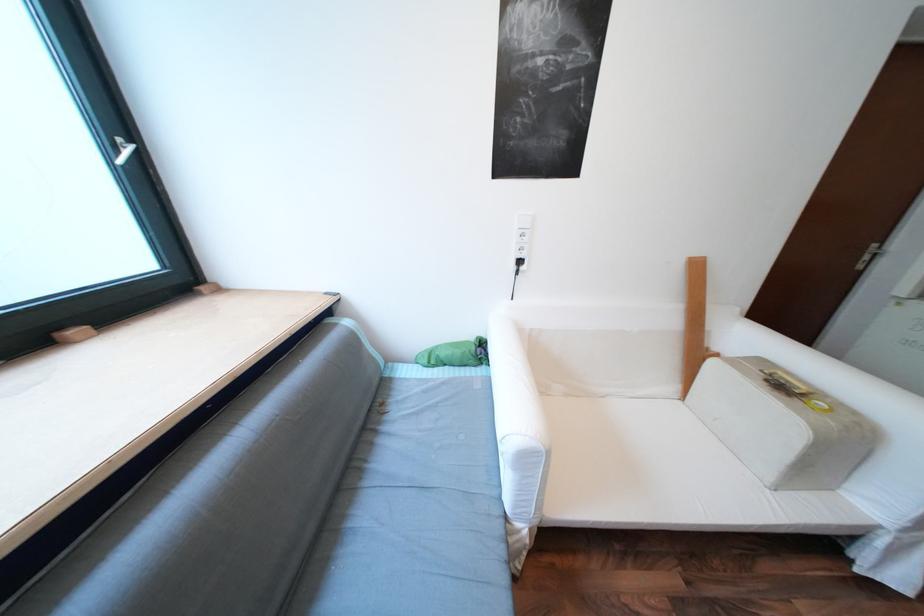
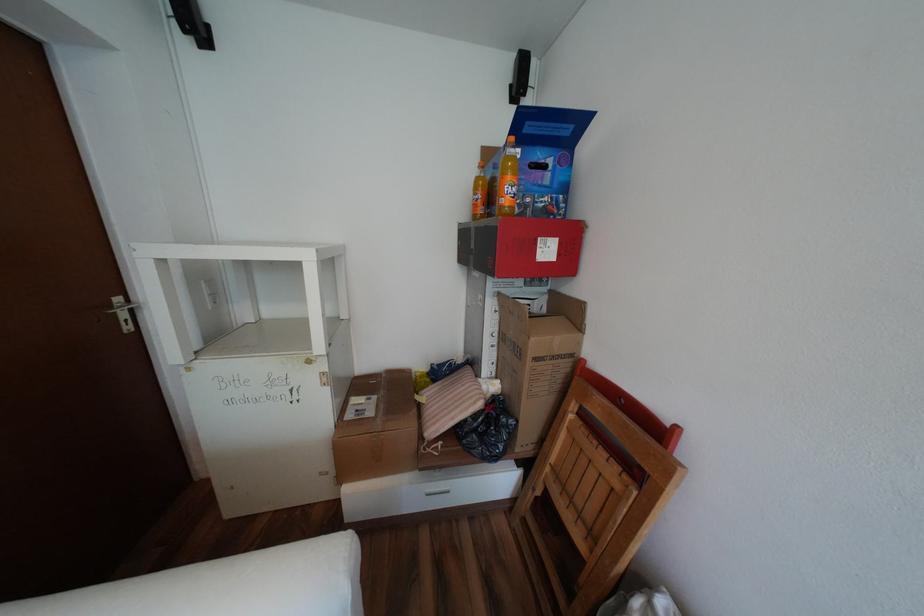
Where in the second image is the point corresponding to point (884, 245) from the first image?

(128, 299)